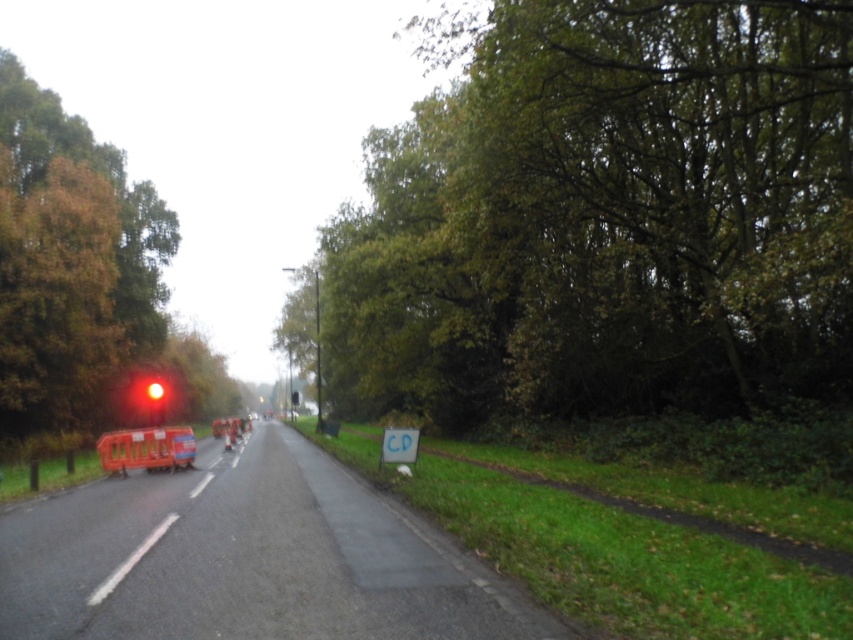
Which is in front, point (19, 202) or point (241, 392)?

Point (19, 202) is in front.

Can you confirm if brown leafy tree at left is positioned to the left of green leafy tree at left?

Incorrect, brown leafy tree at left is not on the left side of green leafy tree at left.

Which is in front, point (68, 241) or point (165, 369)?

Point (68, 241)

Identify the location of brown leafy tree at left. The width and height of the screenshot is (853, 640). (70, 264).

Which is in front, point (761, 298) or point (163, 403)?

Positioned in front is point (761, 298).

What do you see at coordinates (605, 218) in the screenshot?
I see `green leafy tree at upper right` at bounding box center [605, 218].

Does point (694, 284) come in front of point (155, 380)?

Yes, point (694, 284) is closer to viewer.

Where is `green leafy tree at upper right`? green leafy tree at upper right is located at coordinates (605, 218).

From the picture: How distant is green leafy tree at left from red glass traffic light at left?

A distance of 46.60 feet exists between green leafy tree at left and red glass traffic light at left.

Which of these two, green leafy tree at left or red glass traffic light at left, stands shorter?

With less height is red glass traffic light at left.

Is point (204, 388) positioned behind point (160, 403)?

Yes, point (204, 388) is farther from viewer.

Identify the location of green leafy tree at left. The image size is (853, 640). (196, 380).